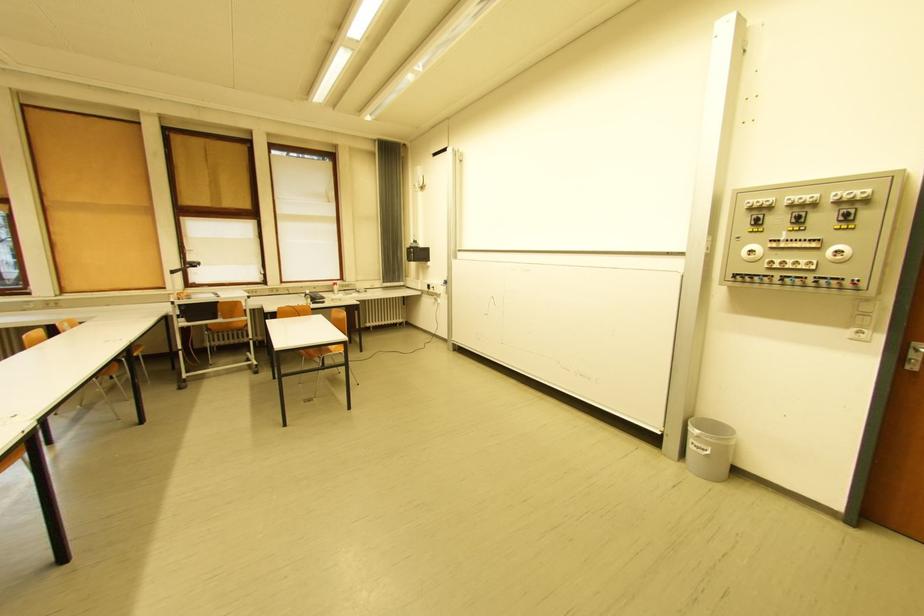
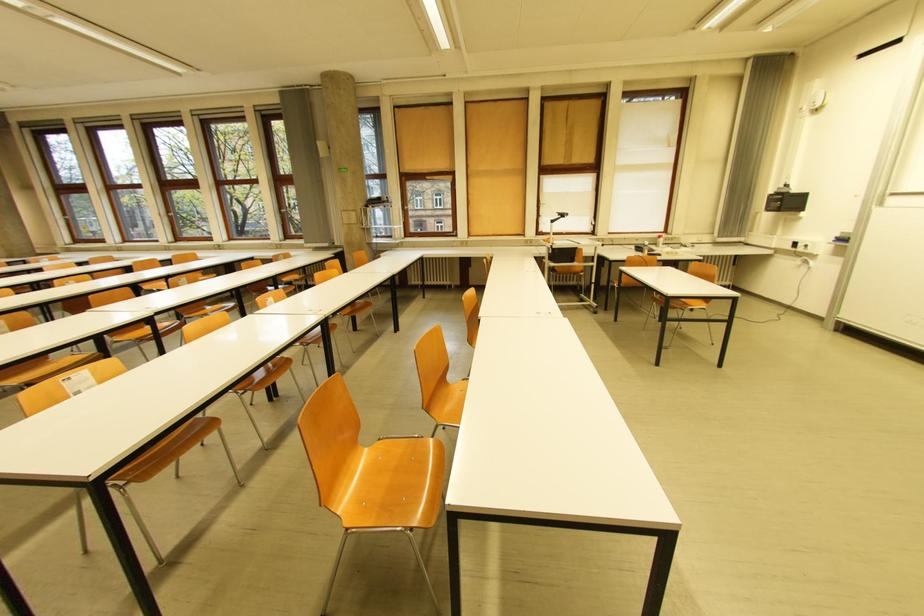
Where in the second image is the point corresponding to point 76,291 from the first image?

(479, 235)